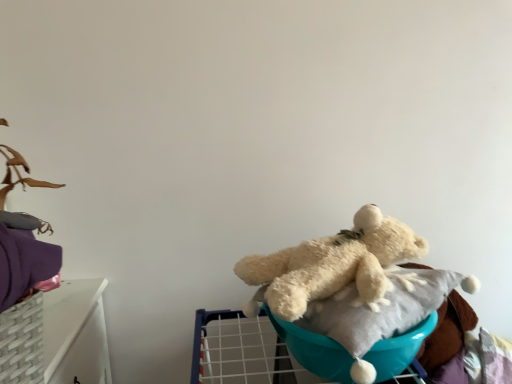
Question: From the image's perspective, is fluffy white teddy bear at center above or below white plush bear at center?

Choices:
 (A) above
 (B) below

Answer: (A)

Question: In terms of width, does fluffy white teddy bear at center look wider or thinner when compared to white plush bear at center?

Choices:
 (A) thin
 (B) wide

Answer: (B)

Question: Considering the positions of fluffy white teddy bear at center and white plush bear at center in the image, is fluffy white teddy bear at center bigger or smaller than white plush bear at center?

Choices:
 (A) small
 (B) big

Answer: (B)

Question: Choose the correct answer: Is white plush bear at center inside fluffy white teddy bear at center or outside it?

Choices:
 (A) inside
 (B) outside

Answer: (B)

Question: From a real-world perspective, relative to fluffy white teddy bear at center, is white plush bear at center vertically above or below?

Choices:
 (A) below
 (B) above

Answer: (A)

Question: Is white plush bear at center wider or thinner than fluffy white teddy bear at center?

Choices:
 (A) wide
 (B) thin

Answer: (B)

Question: In terms of height, does white plush bear at center look taller or shorter compared to fluffy white teddy bear at center?

Choices:
 (A) short
 (B) tall

Answer: (A)